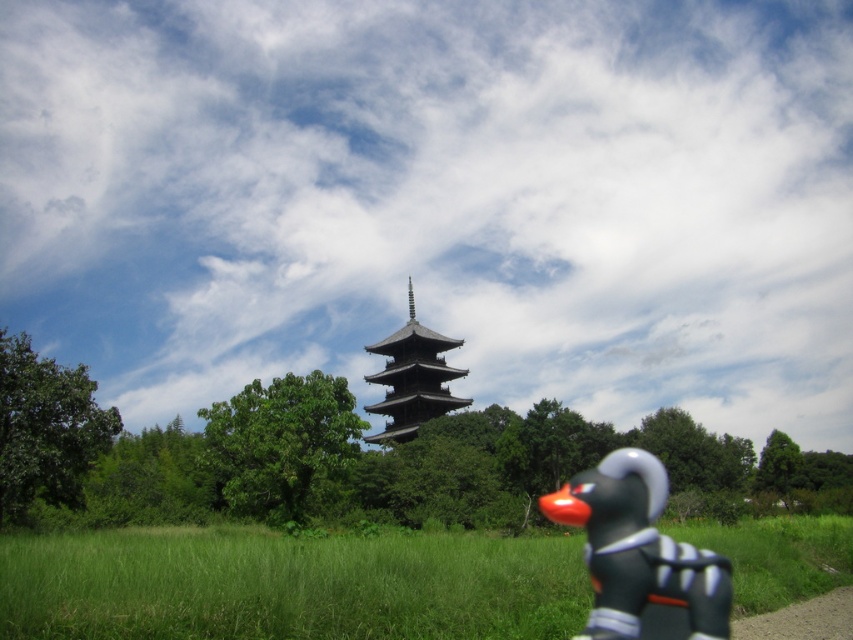
You are standing at the pagoda and want to place a small figurine on the green grassy field at lower center. According to the coordinates provided, where exactly should you place the figurine?

The green grassy field at lower center is located at coordinates point (x=289, y=584), so you should place the figurine there.

You are standing in the middle of the green grassy field at lower center and want to walk to the matte black figurine at lower right. Which direction should you head?

Since the green grassy field at lower center is to the left of the matte black figurine at lower right, you should head to the right to reach the matte black figurine at lower right from the green grassy field at lower center.

You are standing in the scene and want to walk towards the pagoda. Which object, the green grassy field at lower center or the matte black figurine at lower right, would you encounter first?

You would encounter the matte black figurine at lower right first because it is closer to you than the green grassy field at lower center, which is further away.